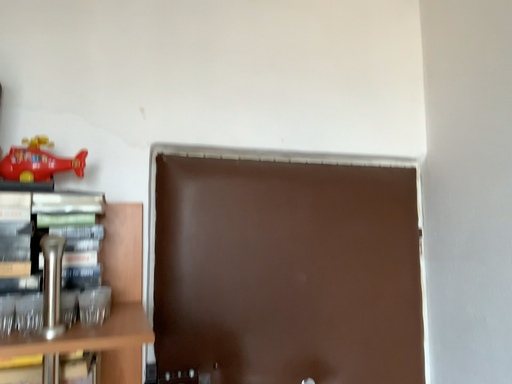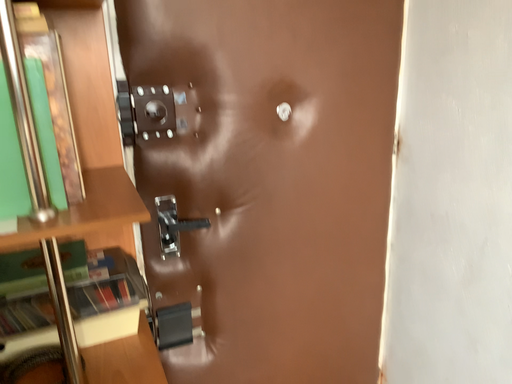
Question: How did the camera likely rotate when shooting the video?

Choices:
 (A) rotated downward
 (B) rotated upward

Answer: (A)